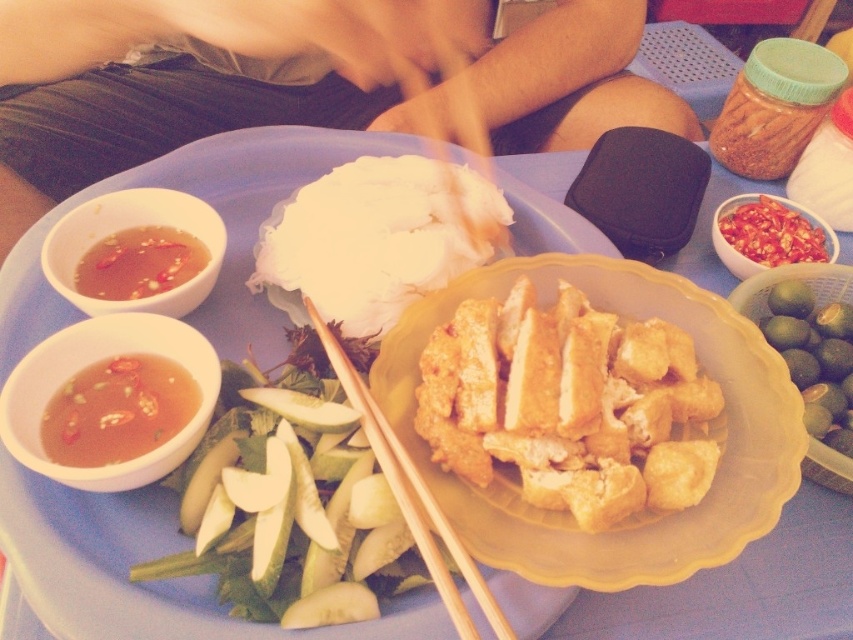
You are a food delivery person who needs to place a hot meal on a tray. The tray has a translucent gelatinous sauce at upper left. To prevent the sauce from spilling, where should you avoid placing the hot meal?

You should avoid placing the hot meal near the translucent gelatinous sauce at upper left, which is located at position point (x=138, y=262), to prevent it from spilling.

You are setting up a table for a meal and need to place a decorative centerpiece. The yellow plastic plate at center is currently at point 0.877, 0.164. Is there enough space to place the centerpiece without overlapping the plate?

The yellow plastic plate at center is located at point (138, 561). Since the coordinates are specific, you need to ensure the centerpiece is placed in an area that doesn not overlap with these coordinates. However, without knowing the size of the centerpiece or the table dimensions, it is impossible to determine if there is enough space. Please provide more details about the centerpiece size or table dimensions for an accurate assessment.